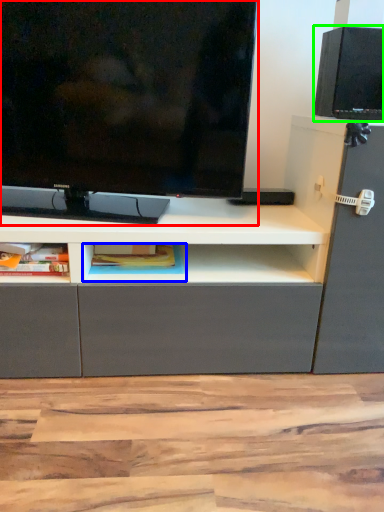
Question: Which object is the closest to the television (highlighted by a red box)? Choose among these: cabinet (highlighted by a blue box) or speaker (highlighted by a green box).

Choices:
 (A) cabinet
 (B) speaker

Answer: (A)